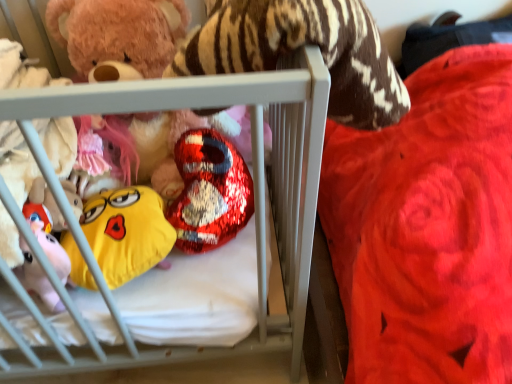
Question: Does point (120, 188) appear closer or farther from the camera than point (222, 215)?

Choices:
 (A) closer
 (B) farther

Answer: (B)

Question: Considering the positions of yellow plush emoji at center, which is the third toy from top to bottom, and shiny metallic heart at center, which is the second toy from bottom to top, in the image, is yellow plush emoji at center, which is the third toy from top to bottom, wider or thinner than shiny metallic heart at center, which is the second toy from bottom to top,?

Choices:
 (A) thin
 (B) wide

Answer: (A)

Question: Which is nearer to the yellow plush emoji at center, which is the third toy from top to bottom?

Choices:
 (A) shiny metallic heart at center, which is the second toy from bottom to top
 (B) soft white crib at center
 (C) shiny metallic heart at center, which ranks as the 1th toy in top-to-bottom order

Answer: (A)

Question: Based on their relative distances, which object is farther from the yellow plush emoji at center, marked as the first toy in a bottom-to-top arrangement?

Choices:
 (A) shiny metallic heart at center, acting as the 2th toy starting from the top
 (B) shiny metallic heart at center, marked as the third toy in a bottom-to-top arrangement
 (C) soft white crib at center

Answer: (B)